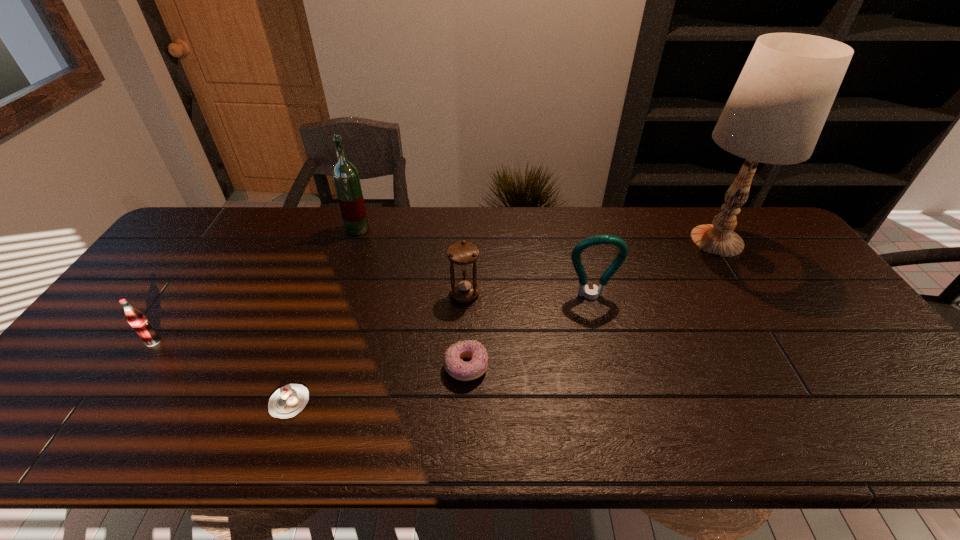
This screenshot has width=960, height=540. I want to click on vacant space situated 0.250m on the left of the lamp, so coord(601,241).

Where is `vacant space located 0.090m on the right of the liquor`? Image resolution: width=960 pixels, height=540 pixels. vacant space located 0.090m on the right of the liquor is located at coordinates (396, 229).

Identify the location of free location located at the jaws of the second object from right to left. (613, 384).

Locate an element on the screen. free spot located on the left of the hourglass is located at coordinates (324, 294).

The width and height of the screenshot is (960, 540). Identify the location of free location located on the label of the leftmost object. (92, 432).

This screenshot has height=540, width=960. I want to click on free region located 0.400m on the left of the sixth tallest object, so pyautogui.click(x=280, y=367).

The width and height of the screenshot is (960, 540). Identify the location of free location located on the back of the shortest object. (309, 348).

The height and width of the screenshot is (540, 960). I want to click on lamp at the far edge, so click(775, 114).

Find the location of `liquor located in the far edge section of the desktop`. liquor located in the far edge section of the desktop is located at coordinates (345, 175).

The width and height of the screenshot is (960, 540). In order to click on object present at the near edge in this screenshot , I will do `click(288, 401)`.